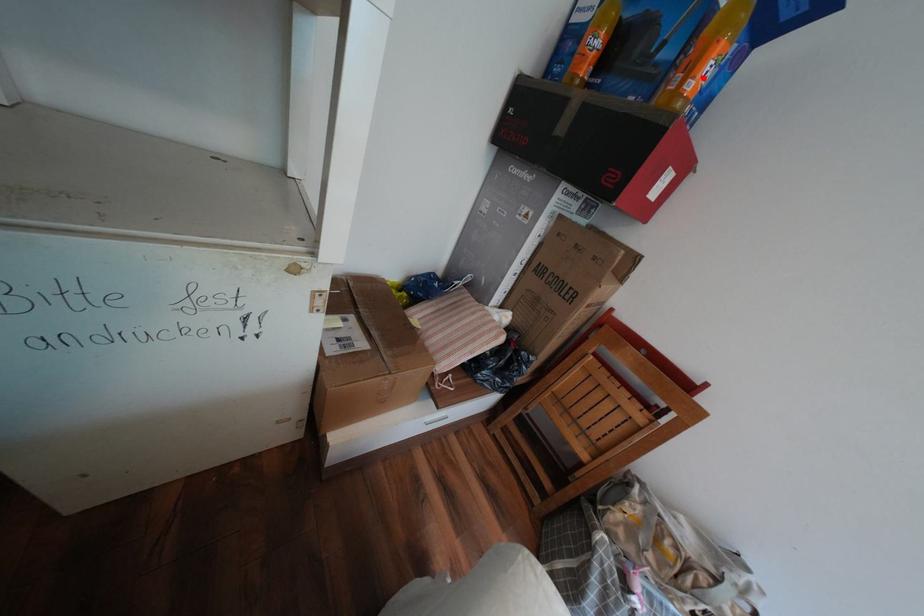
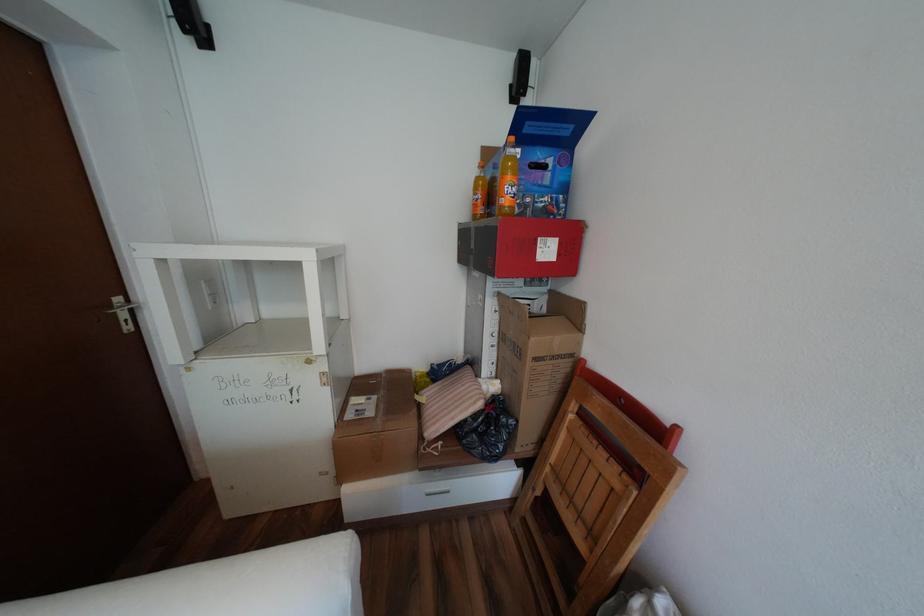
Question: I am providing you with two images of the same scene from different viewpoints. A red point is marked on the first image. Is the red point's position out of view in image 2?

Choices:
 (A) Yes
 (B) No

Answer: (B)